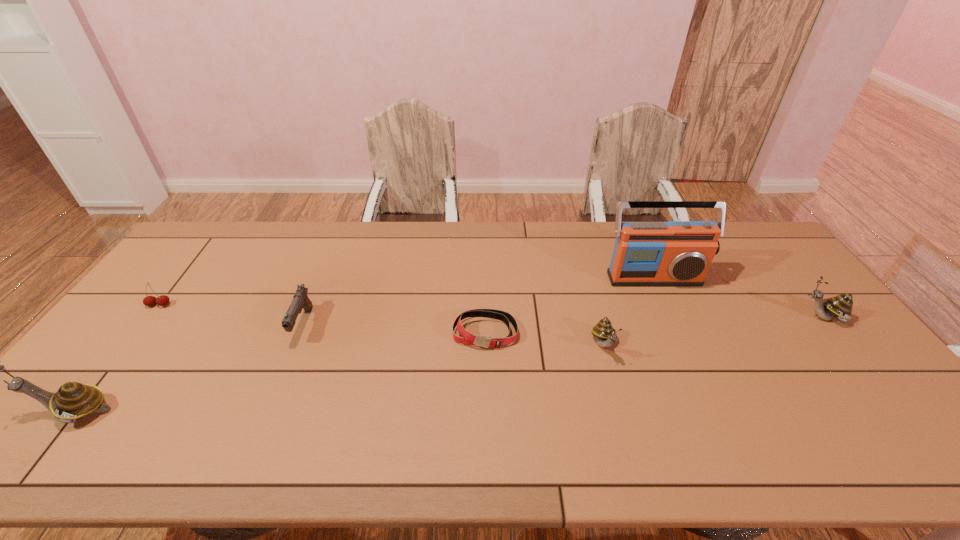
If we want them evenly spaced by inserting an extra escargot among them, please locate a free spot for this new escargot. Please provide its 2D coordinates. Your answer should be formatted as a tuple, i.e. [(x, y)], where the tuple contains the x and y coordinates of a point satisfying the conditions above.

[(357, 376)]